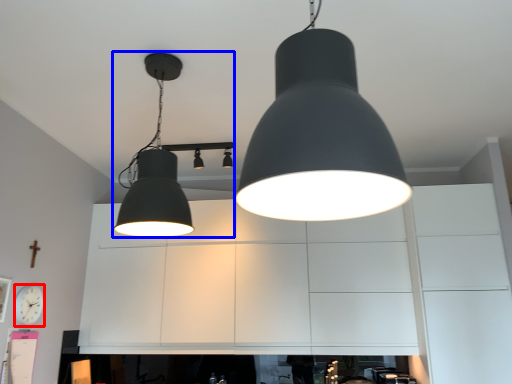
Question: Which of the following is the closest to the observer, clock (highlighted by a red box) or lamp (highlighted by a blue box)?

Choices:
 (A) clock
 (B) lamp

Answer: (B)